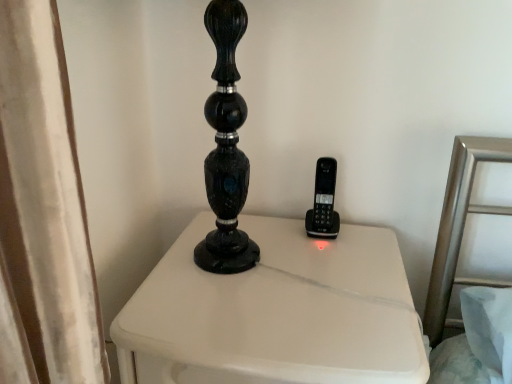
Identify the location of vacant space to the right of black plastic phone at center. (365, 231).